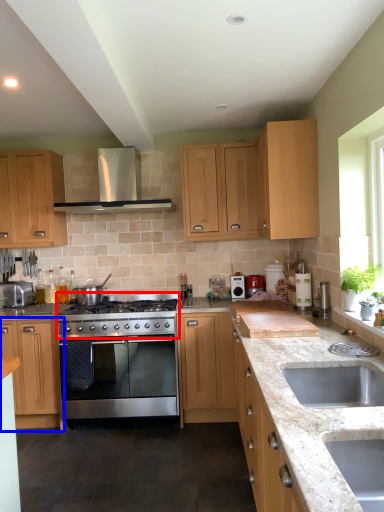
Question: Which of the following is the closest to the observer, gas stove (highlighted by a red box) or cabinetry (highlighted by a blue box)?

Choices:
 (A) gas stove
 (B) cabinetry

Answer: (A)